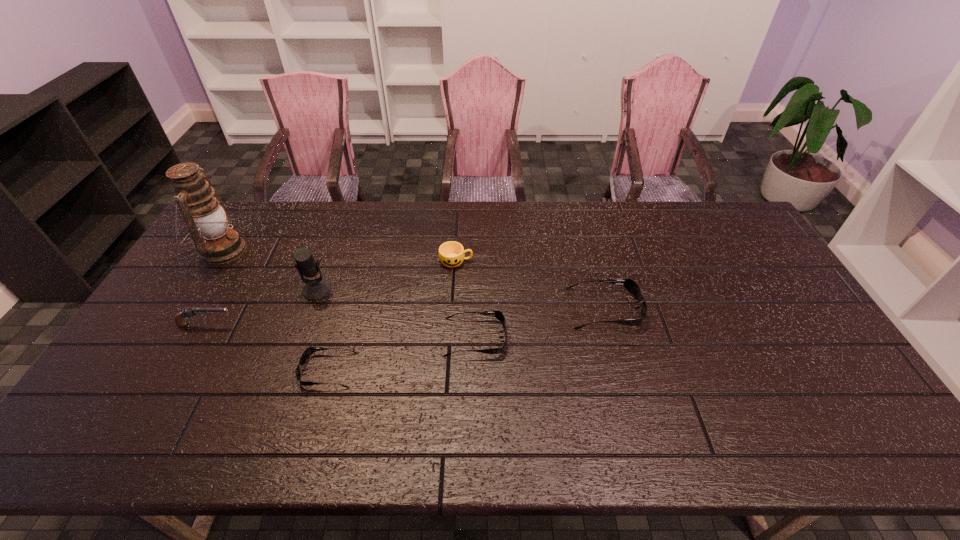
Identify which object is the closest to the shortest object. Please provide its 2D coordinates. Your answer should be formatted as a tuple, i.e. [(x, y)], where the tuple contains the x and y coordinates of a point satisfying the conditions above.

[(315, 289)]

Identify which sunglasses is the second closest to the tallest object. Please provide its 2D coordinates. Your answer should be formatted as a tuple, i.e. [(x, y)], where the tuple contains the x and y coordinates of a point satisfying the conditions above.

[(498, 314)]

You are a GUI agent. You are given a task and a screenshot of the screen. Output one action in this format:
    pyautogui.click(x=<x>, y=<y>)
    Task: Click on the third closest sunglasses relative to the microphone
    The image size is (960, 540).
    Given the screenshot: What is the action you would take?
    pyautogui.click(x=629, y=284)

In order to click on vacant space that satisfies the following two spatial constraints: 1. on the front side of the tallest object; 2. on the right side of the second tallest object in this screenshot , I will do click(x=198, y=289).